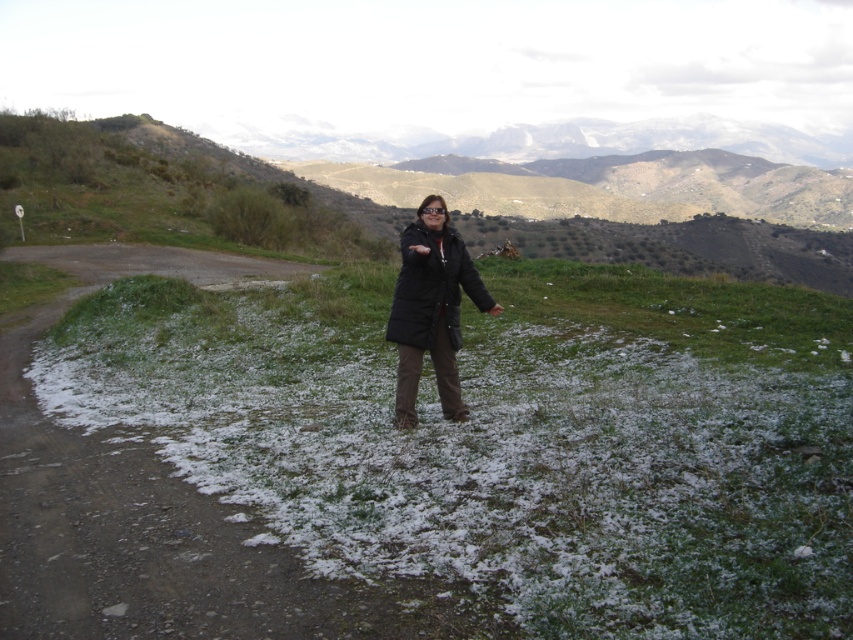
You are a photographer trying to capture the scene with the white powdery snow at center and the black matte jacket at center. Based on their heights, which one will appear larger in the photo?

The white powdery snow at center is taller than the black matte jacket at center, so it will appear larger in the photo.

You are a photographer planning to take a picture of the black matte jacket at center and the white powdery snow at center. Based on their positions, which object should you focus on first to ensure both are in sharp focus?

The white powdery snow at center is below the black matte jacket at center, so you should focus on the black matte jacket at center first to ensure both are in sharp focus since it is closer to the camera.

You are navigating a drone that needs to take a photo of the white powdery snow at center. The drone is currently above the person standing on the grassy area. According to the coordinates provided, is the snow located to the left or right of the person?

The white powdery snow at center is located at point 0.686 on the x and y axis. Since the person is standing on the grassy area, which is partially covered with snow, the snow is centered relative to the person. Therefore, the snow is directly in front of the person, not to the left or right.